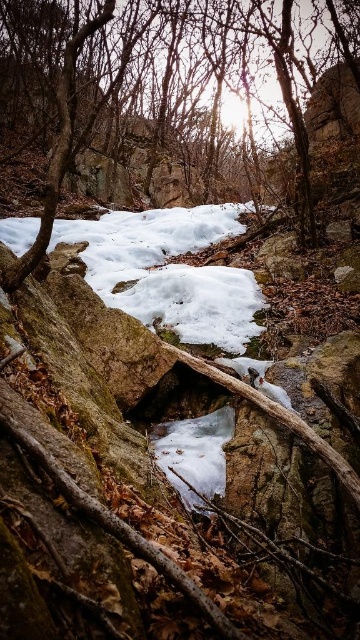
You are a photographer trying to capture a closeup of both point [273,38] and point [228,321] in the winter forest scene. Since you can only focus on one point at a time, which point should you choose to ensure the other point remains in focus?

You should focus on point [228,321] because it is closer to the camera than point [273,38]. By focusing on the closer point, the depth of field will likely include the farther point in acceptable focus.

You are a hiker trying to cross the white frosty snow at center. There is a brown wood tree at center in your path. Which direction should you move to avoid it?

The brown wood tree at center is on the left side of the white frosty snow at center, so you should move to the right to avoid it.